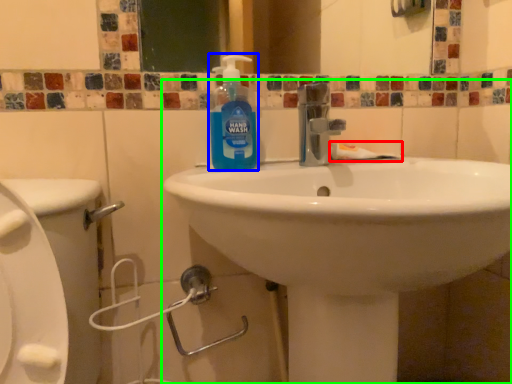
Question: Based on their relative distances, which object is nearer to toothpaste (highlighted by a red box)? Choose from cleaning product (highlighted by a blue box) and sink (highlighted by a green box).

Choices:
 (A) cleaning product
 (B) sink

Answer: (A)